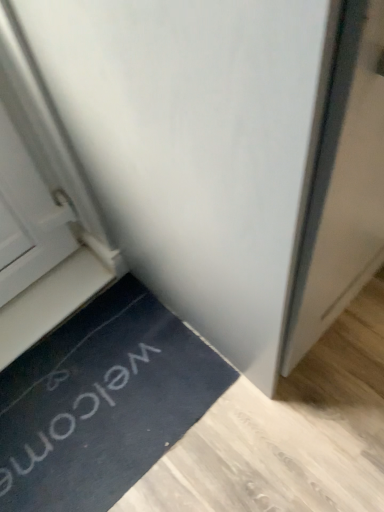
In order to click on free space above white plastic stairwell at lower left (from a real-world perspective) in this screenshot , I will do click(x=54, y=301).